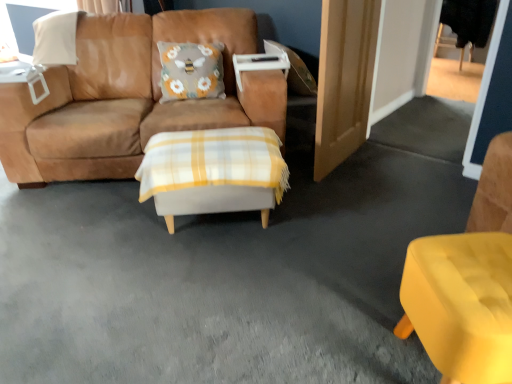
Question: Does suede brown couch at center have a lesser width compared to white plastic table at upper left, which is counted as the 1th table, starting from the left?

Choices:
 (A) yes
 (B) no

Answer: (B)

Question: Is suede brown couch at center positioned behind white plastic table at upper left, the 1th table in the top-to-bottom sequence?

Choices:
 (A) yes
 (B) no

Answer: (B)

Question: Is suede brown couch at center bigger than white plastic table at upper left, which is counted as the 1th table, starting from the left?

Choices:
 (A) yes
 (B) no

Answer: (A)

Question: Is suede brown couch at center looking in the opposite direction of white plastic table at upper left, the 1th table in the top-to-bottom sequence?

Choices:
 (A) yes
 (B) no

Answer: (B)

Question: Does suede brown couch at center turn towards white plastic table at upper left, which is counted as the 1th table, starting from the left?

Choices:
 (A) no
 (B) yes

Answer: (A)

Question: Can you see suede brown couch at center touching white plastic table at upper left, which is the 2th table from right to left?

Choices:
 (A) no
 (B) yes

Answer: (A)

Question: Does white plastic table at upper left, which is counted as the 1th table, starting from the left, have a larger size compared to white plaid ottoman at center, arranged as the 2th table when viewed from the top?

Choices:
 (A) no
 (B) yes

Answer: (A)

Question: Is white plastic table at upper left, acting as the second table starting from the front, positioned beyond the bounds of white plaid ottoman at center, marked as the first table in a bottom-to-top arrangement?

Choices:
 (A) no
 (B) yes

Answer: (B)

Question: Does white plastic table at upper left, which is counted as the 1th table, starting from the back, come behind white plaid ottoman at center, acting as the 1th table starting from the front?

Choices:
 (A) yes
 (B) no

Answer: (A)

Question: Considering the relative sizes of white plastic table at upper left, which is counted as the 1th table, starting from the back, and white plaid ottoman at center, marked as the 1th table in a right-to-left arrangement, in the image provided, is white plastic table at upper left, which is counted as the 1th table, starting from the back, shorter than white plaid ottoman at center, marked as the 1th table in a right-to-left arrangement,?

Choices:
 (A) no
 (B) yes

Answer: (B)

Question: Are white plastic table at upper left, which is counted as the 1th table, starting from the back, and white plaid ottoman at center, arranged as the 2th table when viewed from the top, far apart?

Choices:
 (A) yes
 (B) no

Answer: (A)

Question: Is white plaid ottoman at center, marked as the 1th table in a right-to-left arrangement, completely or partially inside white plastic table at upper left, the 1th table in the top-to-bottom sequence?

Choices:
 (A) no
 (B) yes

Answer: (A)

Question: Can you confirm if wooden door at right is bigger than white plastic table at upper left, placed as the 2th table when sorted from bottom to top?

Choices:
 (A) yes
 (B) no

Answer: (A)